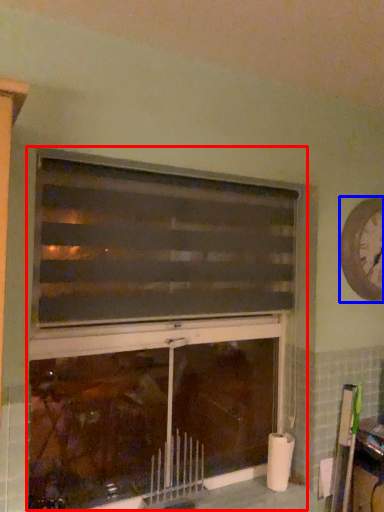
Question: Which of the following is the closest to the observer, fireplace (highlighted by a red box) or clock (highlighted by a blue box)?

Choices:
 (A) fireplace
 (B) clock

Answer: (A)